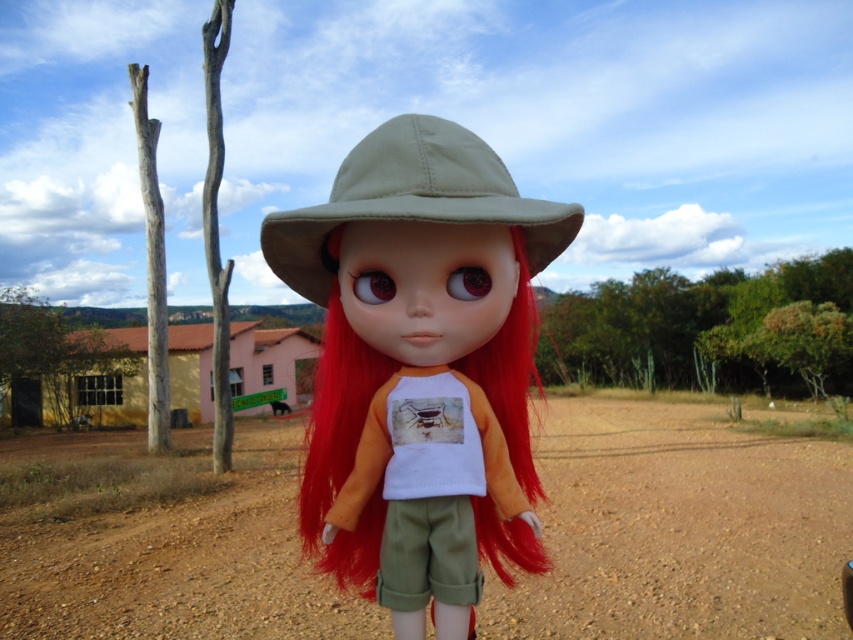
Is brown sandy dirt at center above matte khaki hat at center?

Actually, brown sandy dirt at center is below matte khaki hat at center.

Is brown sandy dirt at center shorter than matte khaki hat at center?

Correct, brown sandy dirt at center is not as tall as matte khaki hat at center.

Who is more forward, [772,554] or [328,444]?

Point [328,444] is more forward.

This screenshot has height=640, width=853. Find the location of `brown sandy dirt at center`. brown sandy dirt at center is located at coordinates click(x=680, y=529).

Looking at this image, is brown sandy dirt at center smaller than khaki fabric hat at center?

Actually, brown sandy dirt at center might be larger than khaki fabric hat at center.

Can you confirm if brown sandy dirt at center is positioned above khaki fabric hat at center?

No, brown sandy dirt at center is not above khaki fabric hat at center.

Identify the location of brown sandy dirt at center. (680, 529).

Is point (408, 502) farther from camera compared to point (469, 204)?

Yes, point (408, 502) is farther from viewer.

Between point (486, 356) and point (515, 205), which one is positioned in front?

Positioned in front is point (515, 205).

Where is `matte khaki hat at center`? This screenshot has width=853, height=640. matte khaki hat at center is located at coordinates (421, 368).